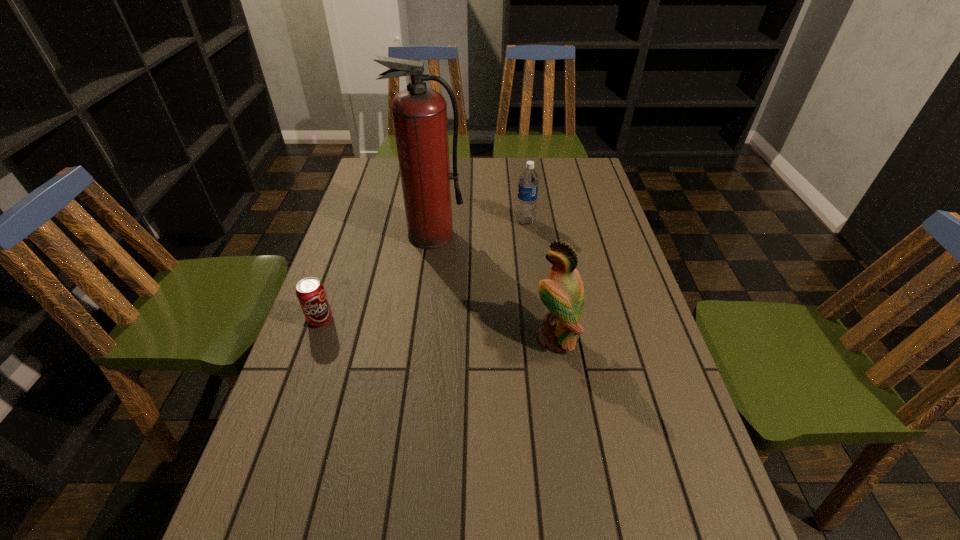
Identify the location of the third object from right to left. (419, 113).

In order to click on fire extinguisher in this screenshot , I will do `click(419, 113)`.

The image size is (960, 540). Find the location of `the second tallest object`. the second tallest object is located at coordinates (562, 293).

Find the location of a particular element. This screenshot has height=540, width=960. water bottle is located at coordinates (528, 184).

Where is `soda`? The height and width of the screenshot is (540, 960). soda is located at coordinates (310, 292).

Locate an element on the screen. Image resolution: width=960 pixels, height=540 pixels. the leftmost object is located at coordinates (310, 292).

The width and height of the screenshot is (960, 540). Find the location of `free space located 0.100m at the nozzle of the second object from left to right`. free space located 0.100m at the nozzle of the second object from left to right is located at coordinates (427, 272).

You are a GUI agent. You are given a task and a screenshot of the screen. Output one action in this format:
    pyautogui.click(x=<x>, y=<y>)
    Task: Click on the free point located 0.400m on the front-facing side of the third shortest object
    The image size is (960, 540).
    Given the screenshot: What is the action you would take?
    pyautogui.click(x=372, y=338)

Identify the location of vacant region located on the front-facing side of the third shortest object. The height and width of the screenshot is (540, 960). [x=420, y=338].

You are a GUI agent. You are given a task and a screenshot of the screen. Output one action in this format:
    pyautogui.click(x=<x>, y=<y>)
    Task: Click on the free point located 0.370m on the front-facing side of the third shortest object
    This screenshot has width=960, height=540.
    Given the screenshot: What is the action you would take?
    pyautogui.click(x=385, y=338)